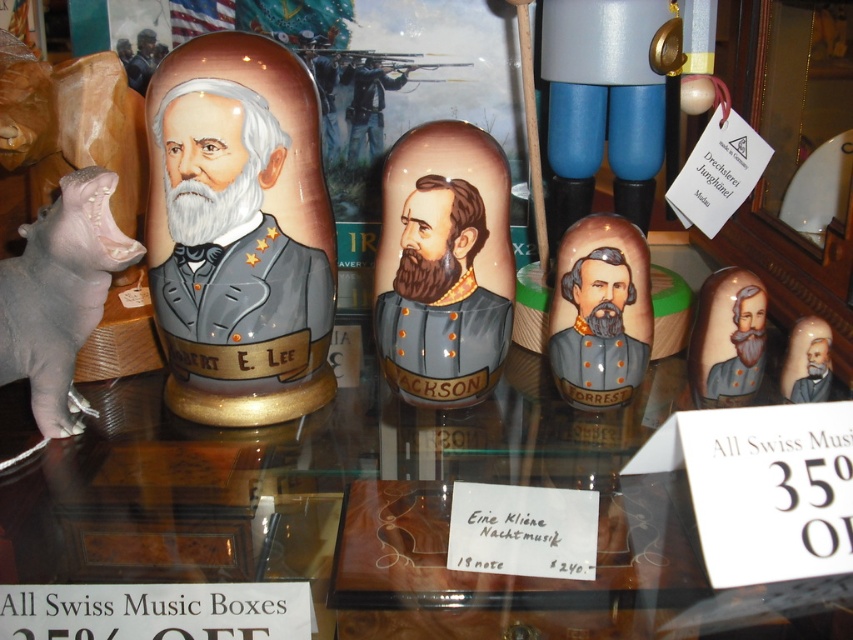
You are an art curator arranging an exhibition about the American Civil War. You have a blue plastic nutcracker at upper center and a matte black portrait at upper left. According to the scene description, which object is placed closer to the front of the display?

The blue plastic nutcracker at upper center is positioned under the matte black portrait at upper left, meaning it is closer to the front of the display.

You are a collector of historical artifacts and you see the blue plastic nutcracker at upper center and the matte black portrait at upper left in the scene. Which object is larger in size?

The blue plastic nutcracker at upper center is bigger than the matte black portrait at upper left.

You are a collector of historical artifacts and have a display case that is 30 inches wide. You want to place the two objects at point (x=461, y=284) in the display case. Will they fit side by side without overlapping?

The two objects at point (x=461, y=284) are 32.85 inches apart, which exceeds the display case width of 30 inches. They will not fit side by side without overlapping.